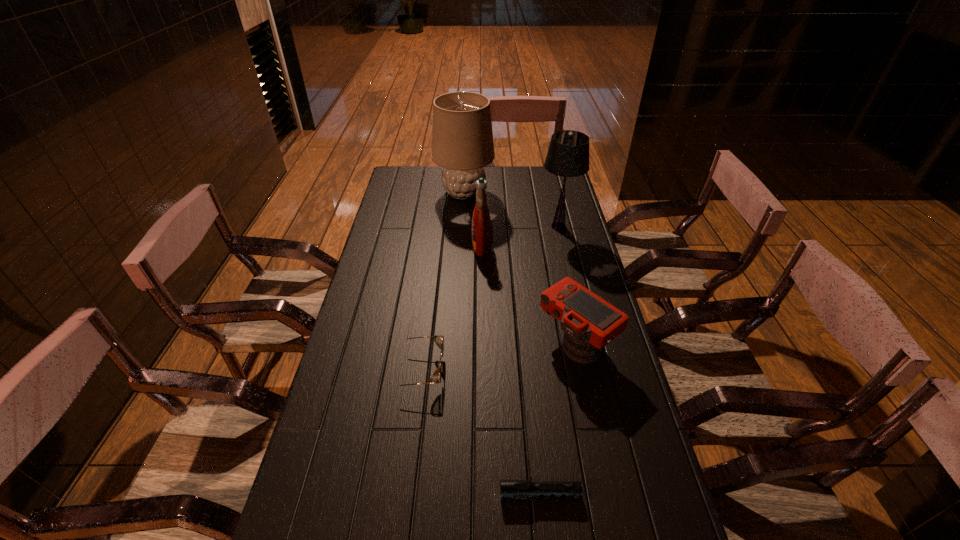
Locate an element on the screen. The height and width of the screenshot is (540, 960). the farther lampshade is located at coordinates (462, 139).

The image size is (960, 540). In order to click on the farthest object in this screenshot , I will do `click(462, 139)`.

Locate an element on the screen. This screenshot has height=540, width=960. the nearer lampshade is located at coordinates (568, 154).

What are the coordinates of `detergent` in the screenshot? It's located at (481, 224).

The image size is (960, 540). I want to click on camera, so click(x=590, y=323).

Locate an element on the screen. Image resolution: width=960 pixels, height=540 pixels. the second shortest object is located at coordinates (439, 339).

You are a GUI agent. You are given a task and a screenshot of the screen. Output one action in this format:
    pyautogui.click(x=<x>, y=<y>)
    Task: Click on the nearest object
    The image size is (960, 540).
    Given the screenshot: What is the action you would take?
    pyautogui.click(x=510, y=489)

You are a GUI agent. You are given a task and a screenshot of the screen. Output one action in this format:
    pyautogui.click(x=<x>, y=<y>)
    Task: Click on the flashlight
    This screenshot has height=540, width=960.
    Given the screenshot: What is the action you would take?
    pyautogui.click(x=510, y=489)

The height and width of the screenshot is (540, 960). I want to click on vacant space situated 0.060m on the left of the left lampshade, so click(420, 193).

Image resolution: width=960 pixels, height=540 pixels. What are the coordinates of `free region located on the front-facing side of the nearer lampshade` in the screenshot? It's located at (492, 226).